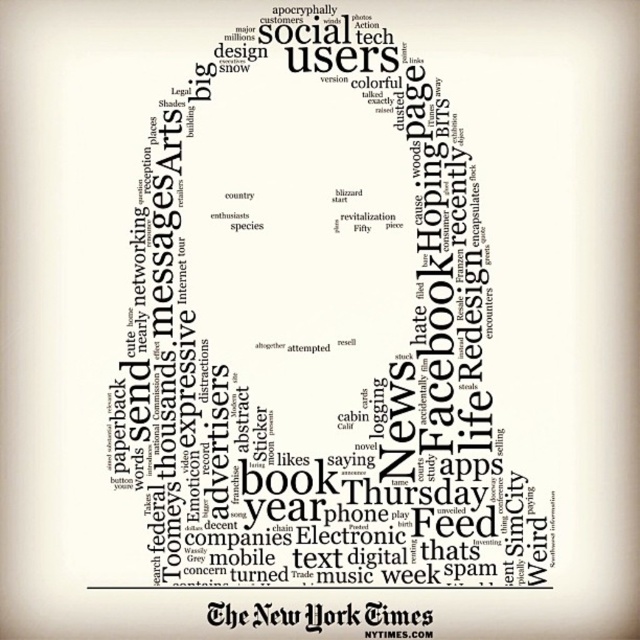
Question: Can you confirm if white paper at center is positioned to the left of black paper at bottom?

Choices:
 (A) yes
 (B) no

Answer: (A)

Question: Does white paper at center appear under black paper at bottom?

Choices:
 (A) yes
 (B) no

Answer: (B)

Question: Among these objects, which one is nearest to the camera?

Choices:
 (A) black paper at bottom
 (B) white paper at center

Answer: (A)

Question: Which object appears farthest from the camera in this image?

Choices:
 (A) black paper at bottom
 (B) white paper at center

Answer: (B)

Question: Is white paper at center behind black paper at bottom?

Choices:
 (A) no
 (B) yes

Answer: (B)

Question: Which of the following is the closest to the observer?

Choices:
 (A) (317, 609)
 (B) (301, 481)

Answer: (A)